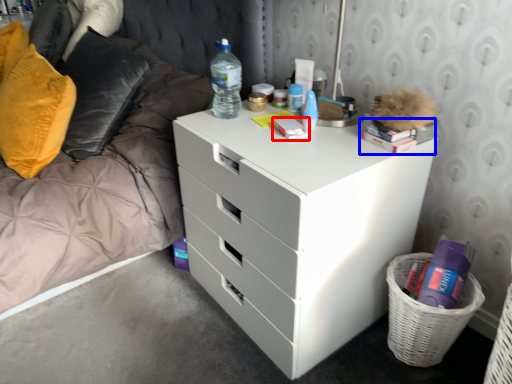
Question: Which object is closer to the camera taking this photo, book (highlighted by a red box) or book (highlighted by a blue box)?

Choices:
 (A) book
 (B) book

Answer: (B)